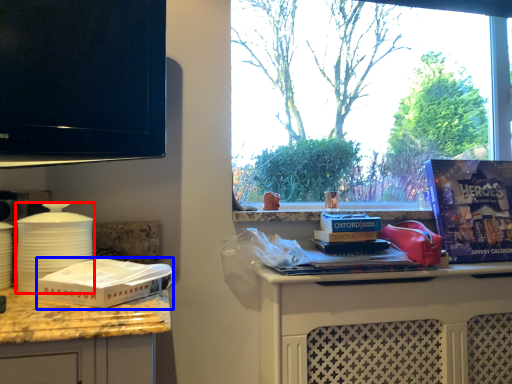
Question: Which object is further to the camera taking this photo, kitchen appliance (highlighted by a red box) or box (highlighted by a blue box)?

Choices:
 (A) kitchen appliance
 (B) box

Answer: (A)